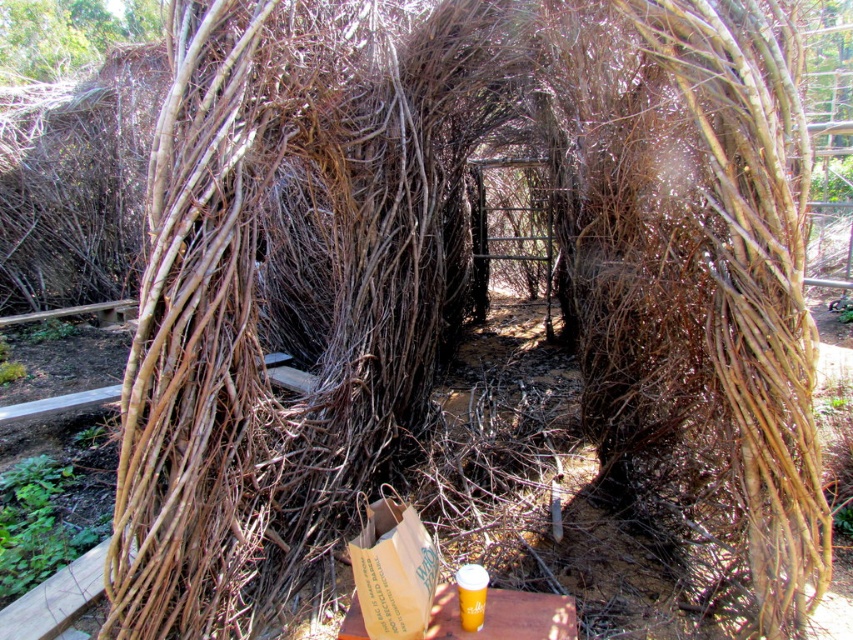
Between brown paper bag at lower center and translucent plastic cup at center, which one appears on the left side from the viewer's perspective?

brown paper bag at lower center is more to the left.

You are a GUI agent. You are given a task and a screenshot of the screen. Output one action in this format:
    pyautogui.click(x=<x>, y=<y>)
    Task: Click on the brown paper bag at lower center
    The width and height of the screenshot is (853, 640).
    Given the screenshot: What is the action you would take?
    pyautogui.click(x=393, y=572)

Can you confirm if brown paper bag at lower center is smaller than brown wood table at lower center?

Actually, brown paper bag at lower center might be larger than brown wood table at lower center.

What are the coordinates of `brown paper bag at lower center` in the screenshot? It's located at (393, 572).

Is brown wood table at lower center positioned at the back of translucent plastic cup at center?

Yes, it is behind translucent plastic cup at center.

Can you confirm if brown wood table at lower center is positioned below translucent plastic cup at center?

Yes.

Is point (538, 595) behind point (469, 576)?

That is True.

Identify the location of brown wood table at lower center. (505, 616).